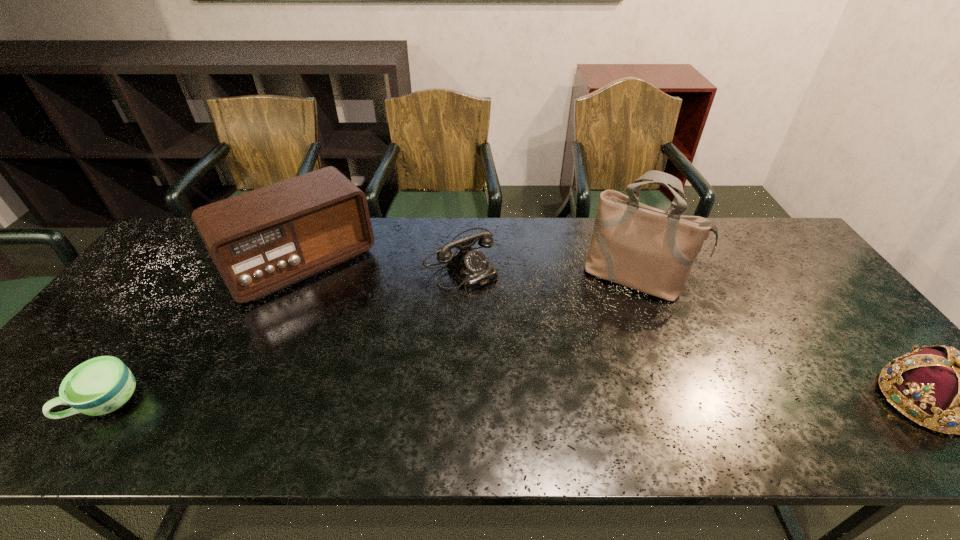
I want to click on empty space between the fourth shortest object and the second shortest object, so click(381, 260).

Identify which object is the third nearest to the radio receiver. Please provide its 2D coordinates. Your answer should be formatted as a tuple, i.e. [(x, y)], where the tuple contains the x and y coordinates of a point satisfying the conditions above.

[(646, 249)]

Where is `object that is the third closest to the third object from left to right`? This screenshot has width=960, height=540. object that is the third closest to the third object from left to right is located at coordinates (101, 385).

I want to click on free point that satisfies the following two spatial constraints: 1. on the back side of the radio receiver; 2. on the left side of the third object from left to right, so click(x=303, y=258).